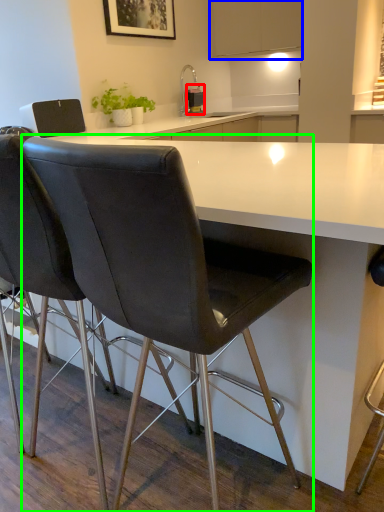
Question: Which is nearer to the kitchen appliance (highlighted by a red box)? cabinetry (highlighted by a blue box) or chair (highlighted by a green box).

Choices:
 (A) cabinetry
 (B) chair

Answer: (A)